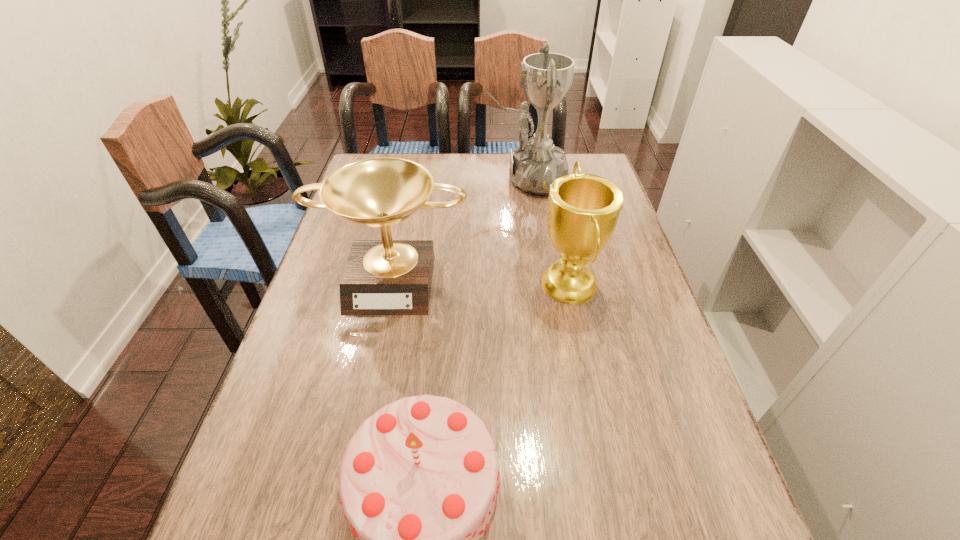
You are a GUI agent. You are given a task and a screenshot of the screen. Output one action in this format:
    pyautogui.click(x=<x>, y=<y>)
    Task: Click on the tallest object
    This screenshot has height=540, width=960.
    Given the screenshot: What is the action you would take?
    pyautogui.click(x=546, y=77)

This screenshot has width=960, height=540. I want to click on the tallest award, so click(x=546, y=77).

Locate an element on the screen. The width and height of the screenshot is (960, 540). the leftmost award is located at coordinates (381, 277).

Find the location of a particular element. The image size is (960, 540). vacant point located 0.320m on the side with emblem of the farthest award is located at coordinates (391, 178).

At what (x,y) coordinates should I click in order to perform the action: click on vacant space located on the side with emblem of the farthest award. Please return your answer as a coordinate pair (x, y). Image resolution: width=960 pixels, height=540 pixels. Looking at the image, I should click on (464, 178).

Image resolution: width=960 pixels, height=540 pixels. I want to click on vacant space located on the side with emblem of the farthest award, so click(x=426, y=178).

Where is `vacant space located 0.400m on the front-facing side of the leftmost award`? vacant space located 0.400m on the front-facing side of the leftmost award is located at coordinates (352, 486).

Find the location of a particular element. The width and height of the screenshot is (960, 540). object that is at the far edge is located at coordinates (546, 77).

Locate an element on the screen. The width and height of the screenshot is (960, 540). object that is at the left edge is located at coordinates (381, 277).

Locate an element on the screen. object situated at the far right corner is located at coordinates point(546,77).